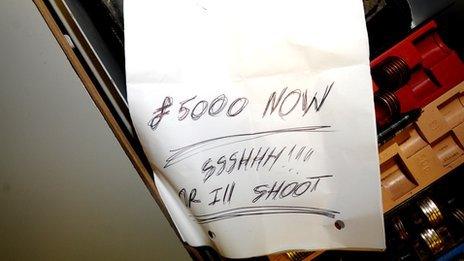
Image resolution: width=464 pixels, height=261 pixels. Identify the location of holder. (447, 194), (417, 152), (421, 62).